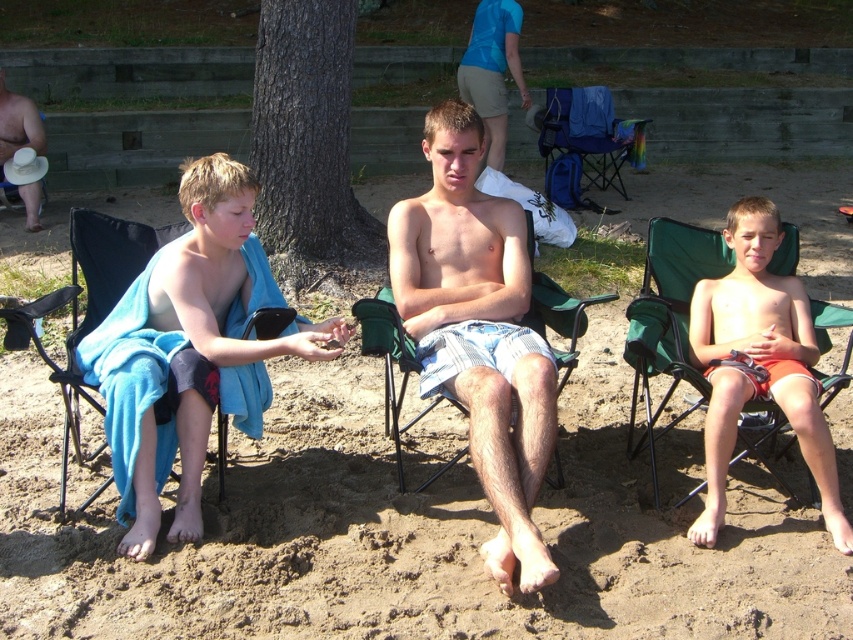
You are standing at the point marked as point (x=187, y=248) and want to throw a ball to your friend who is at the other end of the beach. The distance between you and your friend is 4.06 meters. If your throwing range is 3.5 meters, can you reach them?

The distance between you and your friend at point (x=187, y=248) is 4.06 meters, which exceeds your throwing range of 3.5 meters. Therefore, you cannot reach them with a single throw.

You are a photographer trying to capture a group photo of the three people in the scene. You want to ensure that the blue towel at left and the green fabric beach chair at center are both visible in the frame. Based on their positions, which object should you place closer to the camera to ensure both are in the shot?

The blue towel at left is to the left of the green fabric beach chair at center, so to include both in the frame, you should position the camera so that the blue towel at left is closer to the camera. This way, both the blue towel at left and the green fabric beach chair at center will be visible without one blocking the other.

You are a photographer trying to capture a wide shot of the beach scene. You need to ensure that both the blue towel at left and the brown rough bark tree at center are fully visible in your frame. Considering their sizes, which object might require you to adjust your camera angle to include it entirely?

The blue towel at left is wider than the brown rough bark tree at center, so it might require adjusting the camera angle to ensure it fits entirely within the frame.